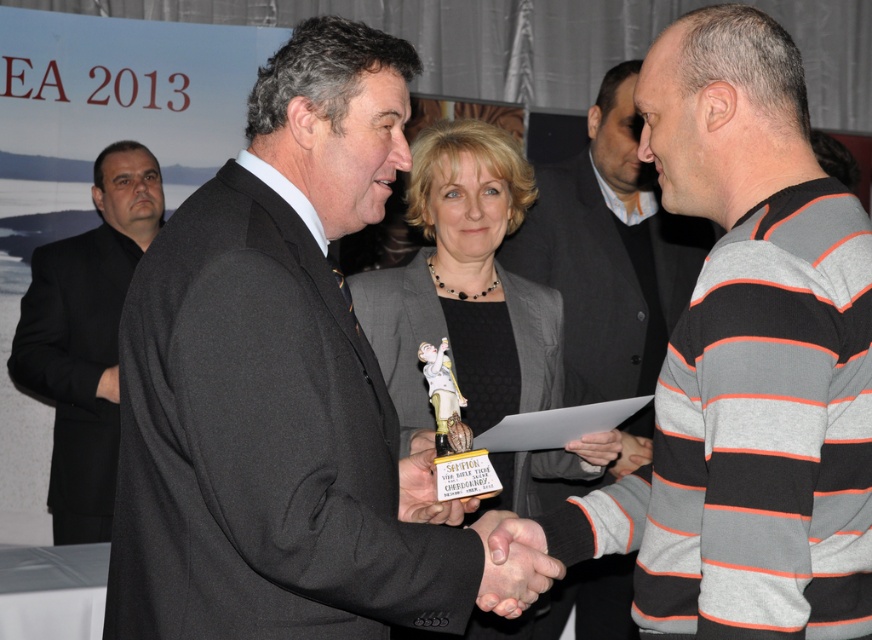
Is point (645, 310) behind point (555, 566)?

Yes, point (645, 310) is behind point (555, 566).

Which is behind, point (618, 259) or point (532, 595)?

Point (618, 259)

In order to click on gray striped sweater at center in this screenshot , I will do `click(610, 252)`.

Where is `metallic gold trophy at center`? This screenshot has height=640, width=872. metallic gold trophy at center is located at coordinates (426, 486).

Is metallic gold trophy at center smaller than matte gray sweater at center?

No, metallic gold trophy at center is not smaller than matte gray sweater at center.

Does point (419, 512) come farther from viewer compared to point (614, 467)?

That is False.

This screenshot has width=872, height=640. I want to click on metallic gold trophy at center, so click(426, 486).

Is point (555, 195) less distant than point (84, 516)?

Yes, point (555, 195) is in front of point (84, 516).

Which of these two, gray striped sweater at center or black matte suit at left, stands taller?

With more height is black matte suit at left.

The image size is (872, 640). I want to click on gray striped sweater at center, so click(x=610, y=252).